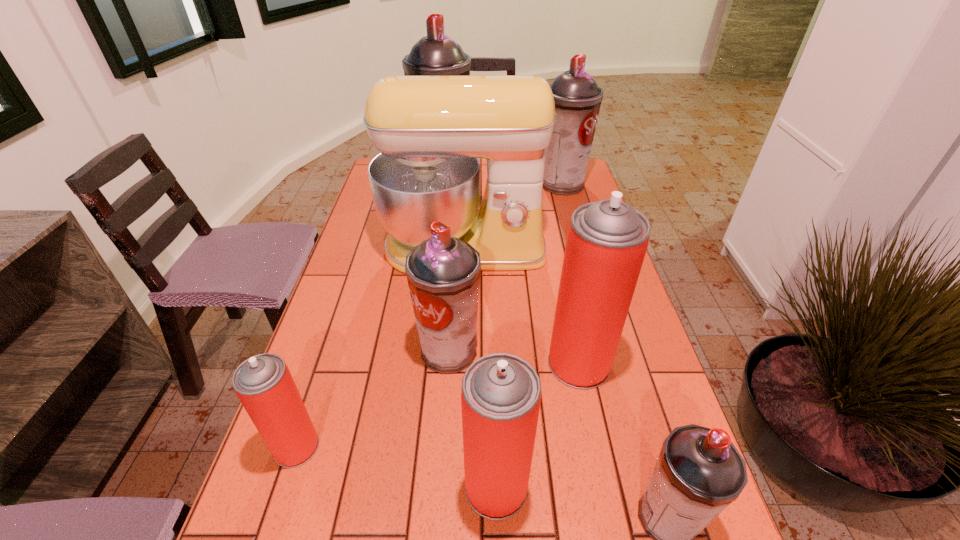
Identify the location of vacant area that lies between the farthest red aerosol can and the leftmost red aerosol can. (438, 406).

The height and width of the screenshot is (540, 960). I want to click on free area in between the mixer and the rightmost red aerosol can, so click(521, 306).

I want to click on object that stands as the seventh closest to the smallest gray aerosol can, so click(x=436, y=54).

In order to click on object that is the second closest to the second biggest gray aerosol can in this screenshot , I will do `click(436, 54)`.

Locate an element on the screen. The width and height of the screenshot is (960, 540). aerosol can that stands as the third closest to the leftmost aerosol can is located at coordinates (607, 240).

Choose which aerosol can is the sixth nearest neighbor to the rightmost red aerosol can. Please provide its 2D coordinates. Your answer should be formatted as a tuple, i.e. [(x, y)], where the tuple contains the x and y coordinates of a point satisfying the conditions above.

[(436, 54)]

Find the location of a particular element. gray aerosol can object that ranks as the third closest to the leftmost red aerosol can is located at coordinates (436, 54).

Select which gray aerosol can is the third closest to the second smallest gray aerosol can. Please provide its 2D coordinates. Your answer should be formatted as a tuple, i.e. [(x, y)], where the tuple contains the x and y coordinates of a point satisfying the conditions above.

[(436, 54)]

Image resolution: width=960 pixels, height=540 pixels. I want to click on red aerosol can that can be found as the second closest to the second smallest red aerosol can, so 263,383.

Locate an element on the screen. The image size is (960, 540). red aerosol can that can be found as the second closest to the mixer is located at coordinates (263, 383).